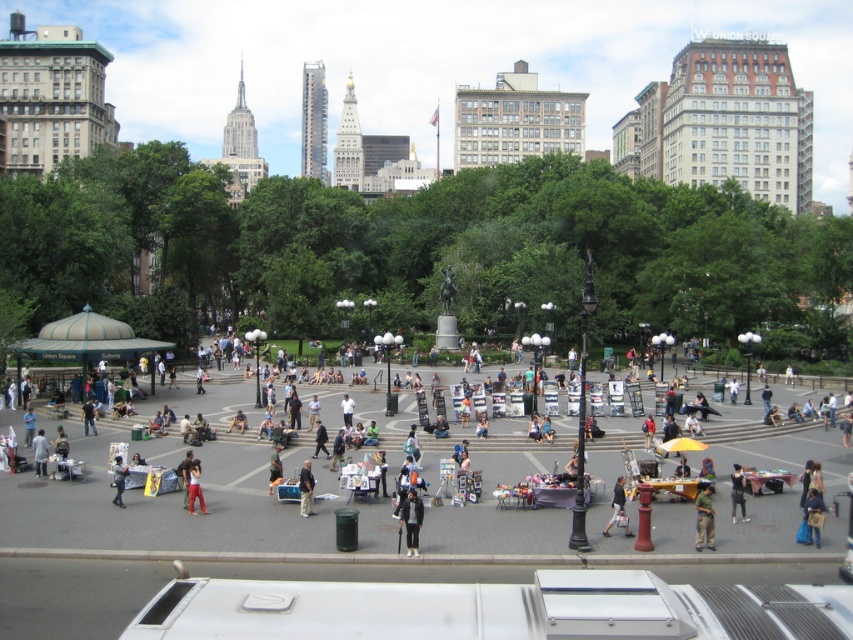
From the picture: Does black matte jacket at center appear over red cotton pants at lower left?

No, black matte jacket at center is not above red cotton pants at lower left.

Between black matte jacket at center and red cotton pants at lower left, which one appears on the left side from the viewer's perspective?

Positioned to the left is red cotton pants at lower left.

Who is more distant from viewer, (740, 474) or (189, 468)?

The point (189, 468) is behind.

Locate an element on the screen. Image resolution: width=853 pixels, height=640 pixels. black matte jacket at center is located at coordinates (737, 492).

Can you confirm if dark gray jacket at center is bigger than red cotton pants at lower left?

Yes, dark gray jacket at center is bigger than red cotton pants at lower left.

Can you confirm if dark gray jacket at center is taller than red cotton pants at lower left?

Yes.

This screenshot has width=853, height=640. In order to click on dark gray jacket at center in this screenshot , I will do `click(410, 520)`.

Identify the location of dark gray jacket at center. (410, 520).

Is point (708, 531) behind point (189, 492)?

No, it is in front of (189, 492).

Is point (711, 486) closer to viewer compared to point (190, 506)?

Yes, point (711, 486) is in front of point (190, 506).

Find the location of a particular element. The image size is (853, 640). green matte shirt at lower right is located at coordinates (704, 516).